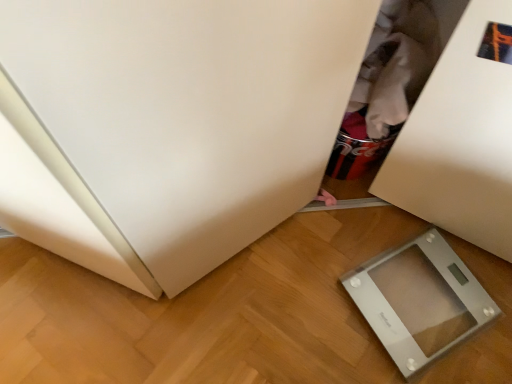
Find the location of a particular element. This screenshot has width=512, height=384. vacant location behind transparent glass scale at lower right is located at coordinates (375, 219).